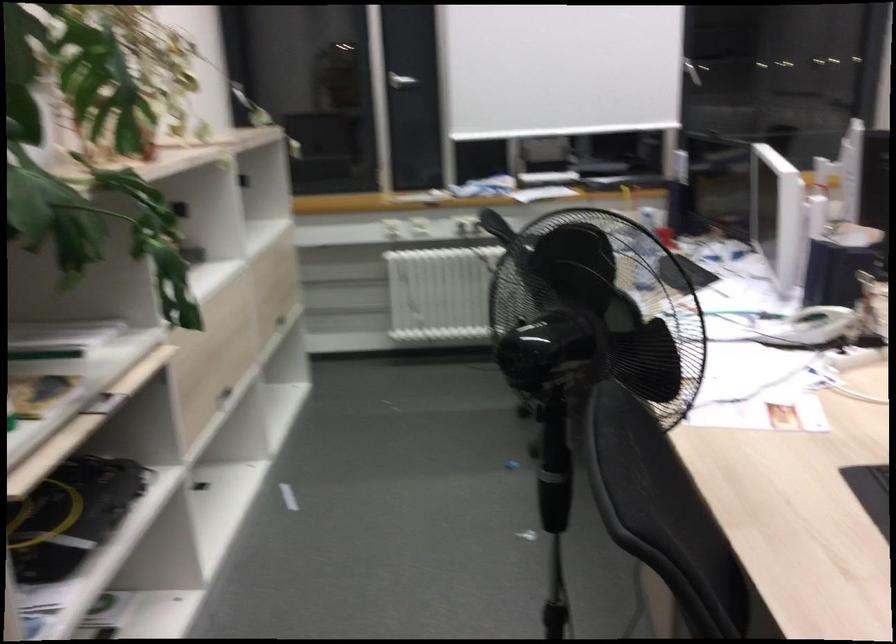
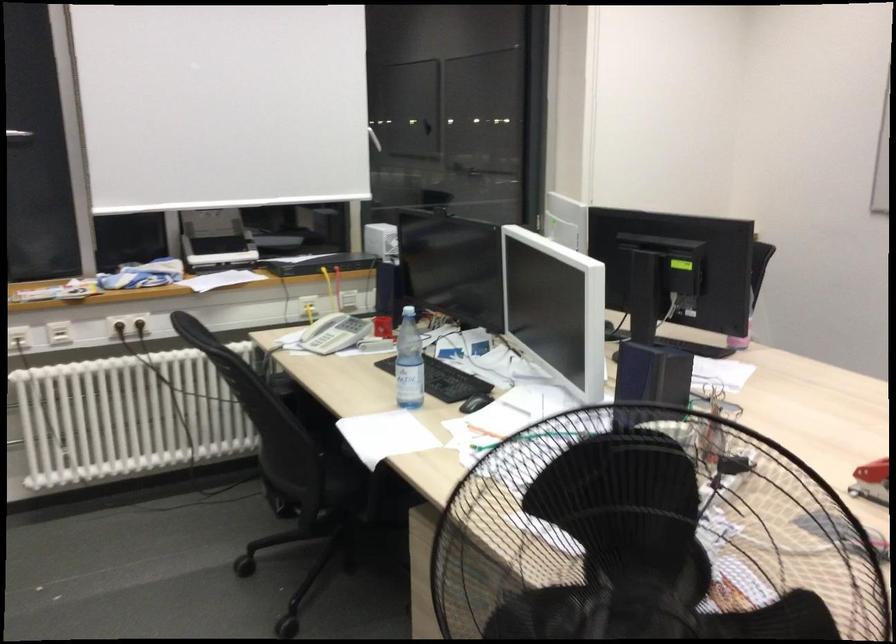
Question: How did the camera likely rotate?

Choices:
 (A) Left
 (B) Right
 (C) Up
 (D) Down

Answer: (B)